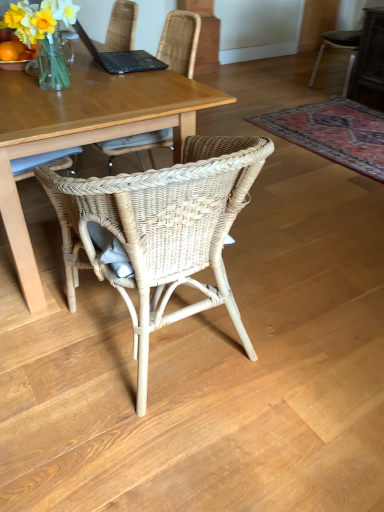
Find the location of a particular element. This screenshot has width=384, height=512. free location in front of woven rattan chair at center, the 2th chair in the right-to-left sequence is located at coordinates (169, 447).